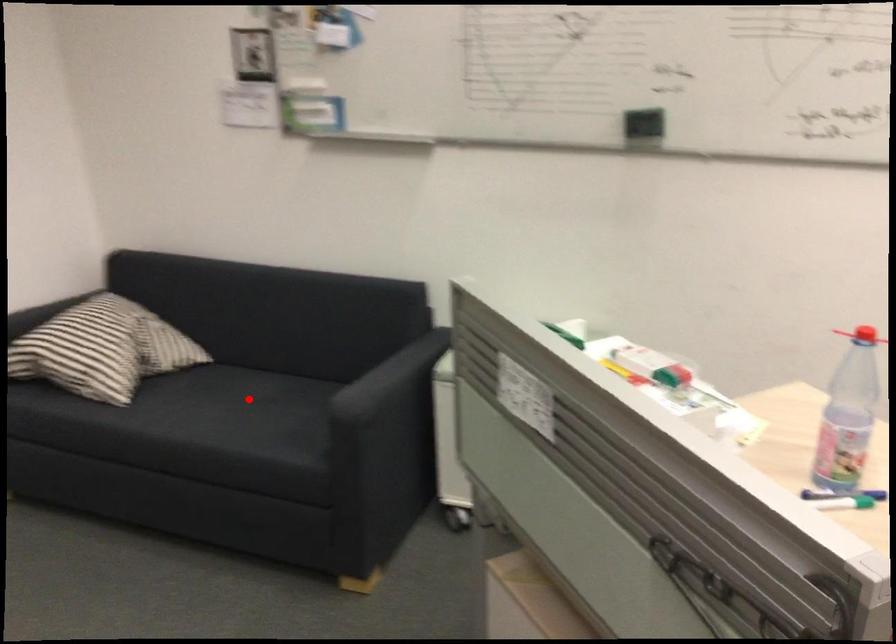
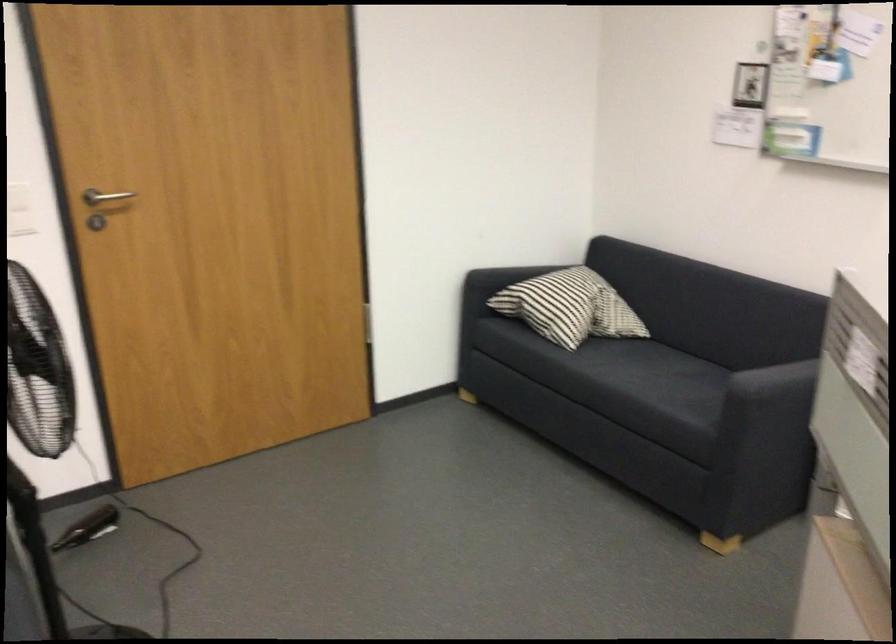
Question: I am providing you with two images of the same scene from different viewpoints. In image1, a red point is highlighted. Considering the same 3D point in image2, which of the following is correct?

Choices:
 (A) It is closer
 (B) It is farther

Answer: (B)